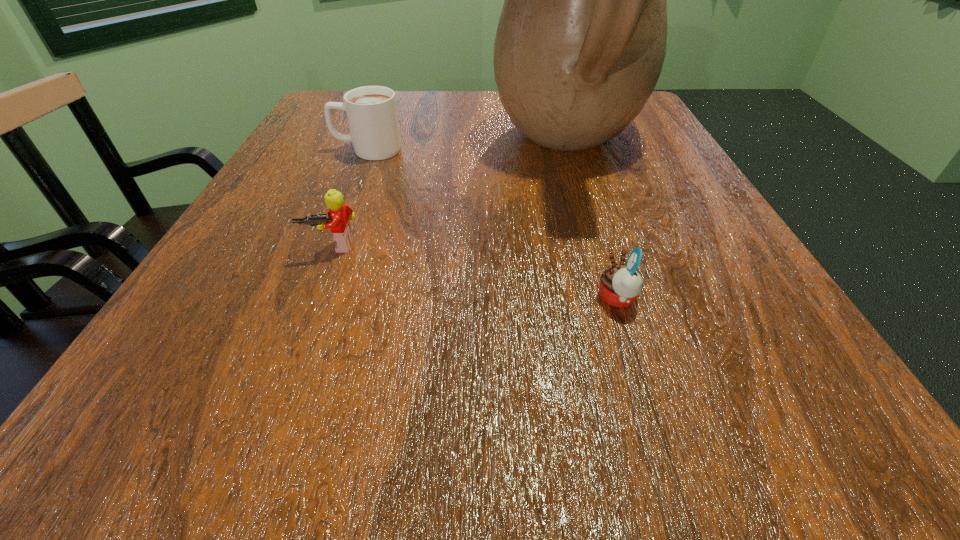
Where is `cream pitcher`? The height and width of the screenshot is (540, 960). cream pitcher is located at coordinates (581, 40).

This screenshot has width=960, height=540. What are the coordinates of `cappuccino` in the screenshot? It's located at (371, 111).

Find the location of `the second nearest object`. the second nearest object is located at coordinates (339, 214).

At what (x,y) coordinates should I click in order to perform the action: click on the second shortest object. Please return your answer as a coordinate pair (x, y). Looking at the image, I should click on (339, 214).

I want to click on the nearest object, so click(620, 285).

Identify the location of muffin. pyautogui.click(x=620, y=285).

Locate an element on the screen. The height and width of the screenshot is (540, 960). free space located at the spout of the tallest object is located at coordinates (430, 146).

You are a GUI agent. You are given a task and a screenshot of the screen. Output one action in this format:
    pyautogui.click(x=<x>, y=<y>)
    Task: Click on the vacant region located 0.190m at the spout of the tallest object
    
    Given the screenshot: What is the action you would take?
    pyautogui.click(x=402, y=146)

Locate an element on the screen. vacant region located at the spout of the tallest object is located at coordinates (316, 146).

Where is `vacant space located 0.050m on the side with the handle of the cappuccino`? This screenshot has width=960, height=540. vacant space located 0.050m on the side with the handle of the cappuccino is located at coordinates (309, 150).